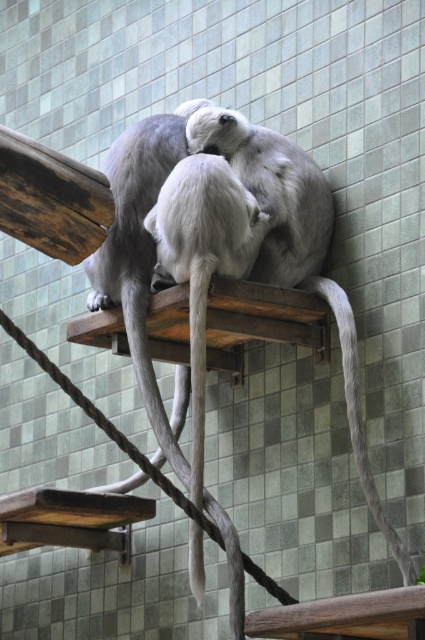
Question: Can you confirm if gray furry tail at center is positioned above gray matte tail at lower right?

Choices:
 (A) no
 (B) yes

Answer: (A)

Question: Which point appears closest to the camera in this image?

Choices:
 (A) (319, 289)
 (B) (138, 324)

Answer: (B)

Question: Does gray furry tail at center have a lesser width compared to gray matte tail at lower right?

Choices:
 (A) yes
 (B) no

Answer: (B)

Question: Which point is farther from the camera taking this photo?

Choices:
 (A) (144, 384)
 (B) (342, 312)

Answer: (A)

Question: Does gray furry tail at center appear on the left side of gray matte tail at lower right?

Choices:
 (A) yes
 (B) no

Answer: (A)